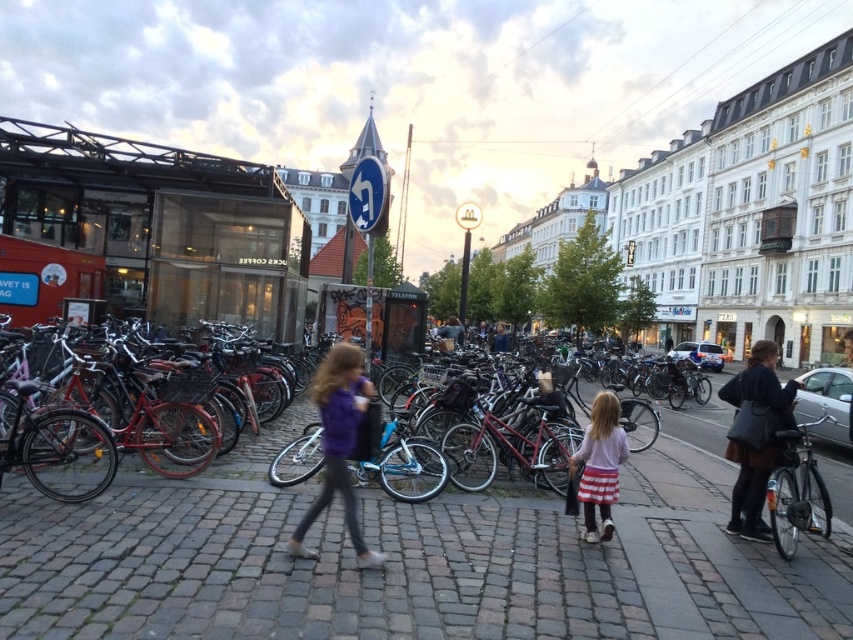
Is dark brown leather jacket at right closer to camera compared to shiny silver bicycle at right?

No, dark brown leather jacket at right is behind shiny silver bicycle at right.

Is dark brown leather jacket at right to the left of shiny silver bicycle at right from the viewer's perspective?

In fact, dark brown leather jacket at right is to the right of shiny silver bicycle at right.

Who is more distant from viewer, (779,410) or (817,490)?

Positioned behind is point (779,410).

This screenshot has height=640, width=853. In order to click on dark brown leather jacket at right in this screenshot , I will do `click(755, 435)`.

Does point (346, 381) lie in front of point (792, 548)?

No, it is not.

Where is `purple fabric jacket at center`? The width and height of the screenshot is (853, 640). purple fabric jacket at center is located at coordinates (338, 442).

Is point (344, 518) behind point (808, 474)?

Yes, point (344, 518) is behind point (808, 474).

Locate an element on the screen. The width and height of the screenshot is (853, 640). purple fabric jacket at center is located at coordinates (338, 442).

Is cobblestone pavement at center to the right of pink fabric skirt at center from the viewer's perspective?

Incorrect, cobblestone pavement at center is not on the right side of pink fabric skirt at center.

Does point (608, 572) come behind point (598, 536)?

No, (608, 572) is in front of (598, 536).

Does point (364, 616) come closer to viewer compared to point (610, 500)?

Yes.

You are a GUI agent. You are given a task and a screenshot of the screen. Output one action in this format:
    pyautogui.click(x=<x>, y=<y>)
    Task: Click on the cobblestone pavement at center
    The image size is (853, 640).
    Given the screenshot: What is the action you would take?
    pyautogui.click(x=407, y=561)